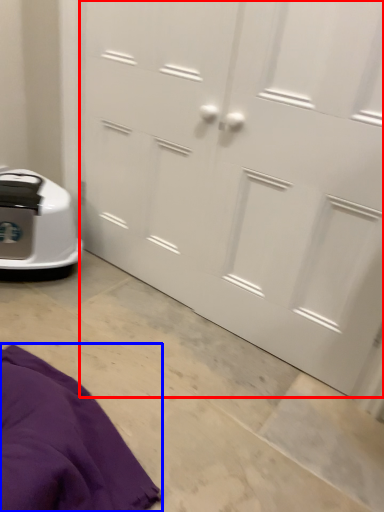
Question: Among these objects, which one is farthest to the camera, door (highlighted by a red box) or blanket (highlighted by a blue box)?

Choices:
 (A) door
 (B) blanket

Answer: (A)